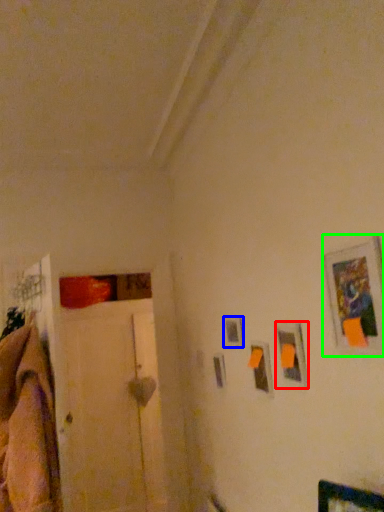
Question: Which object is the closest to the picture frame (highlighted by a red box)? Choose among these: picture frame (highlighted by a blue box) or picture frame (highlighted by a green box).

Choices:
 (A) picture frame
 (B) picture frame

Answer: (B)